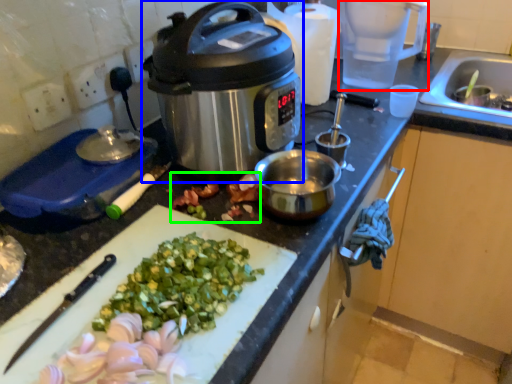
Question: Based on their relative distances, which object is nearer to blender (highlighted by a red box)? Choose from slow cooker (highlighted by a blue box) and produce (highlighted by a green box).

Choices:
 (A) slow cooker
 (B) produce

Answer: (A)